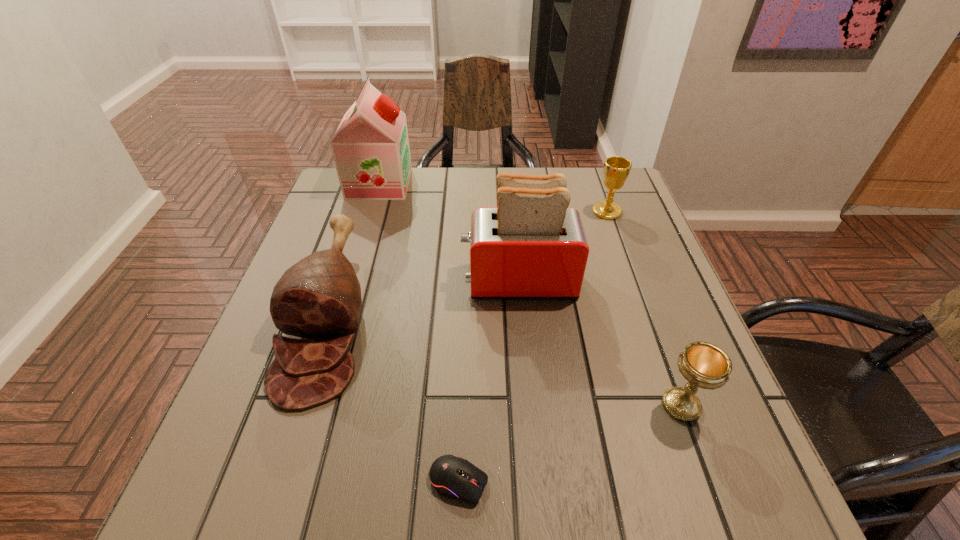
Locate an element on the screen. The image size is (960, 540). free space that satisfies the following two spatial constraints: 1. at the sliced end of the nearer chalice; 2. on the left side of the ham is located at coordinates (300, 406).

Identify the location of vacant space that satisfies the following two spatial constraints: 1. on the front-facing side of the nearer chalice; 2. on the right side of the toaster. The height and width of the screenshot is (540, 960). (530, 406).

Locate an element on the screen. This screenshot has width=960, height=540. vacant position in the image that satisfies the following two spatial constraints: 1. with the cap open on the farthest object; 2. on the left side of the shortest object is located at coordinates (289, 482).

This screenshot has height=540, width=960. Identify the location of vacant space that satisfies the following two spatial constraints: 1. on the back side of the nearer chalice; 2. with the cap open on the farthest object. (601, 183).

Identify the location of free spot that satisfies the following two spatial constraints: 1. at the sliced end of the ham; 2. on the left side of the computer mouse. click(275, 482).

The image size is (960, 540). What are the coordinates of `free space in the image that satisfies the following two spatial constraints: 1. on the front-facing side of the toaster; 2. at the sliced end of the ham` in the screenshot? It's located at (521, 315).